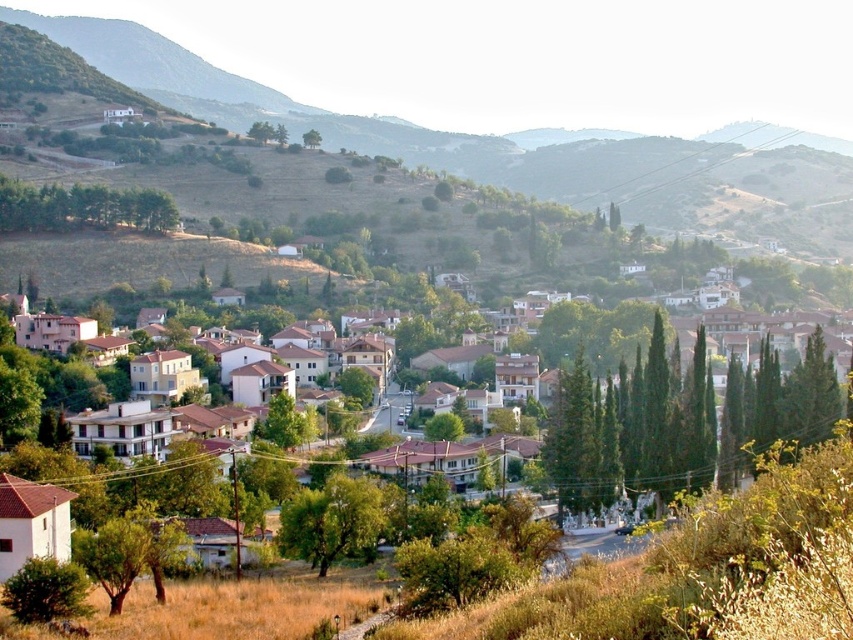
Based on the scene description, what is located at the coordinates point (631, 428)?

The coordinates point (631, 428) indicate green textured trees at center.

You are standing in the village and want to take a photo of both point (825,433) and point (326,552) in the same frame. Which point should you focus on first to ensure both are in focus?

You should focus on point (326,552) first because it is closer to you than point (825,433), which is further away. By focusing on the closer point, the depth of field may include both points in the frame.